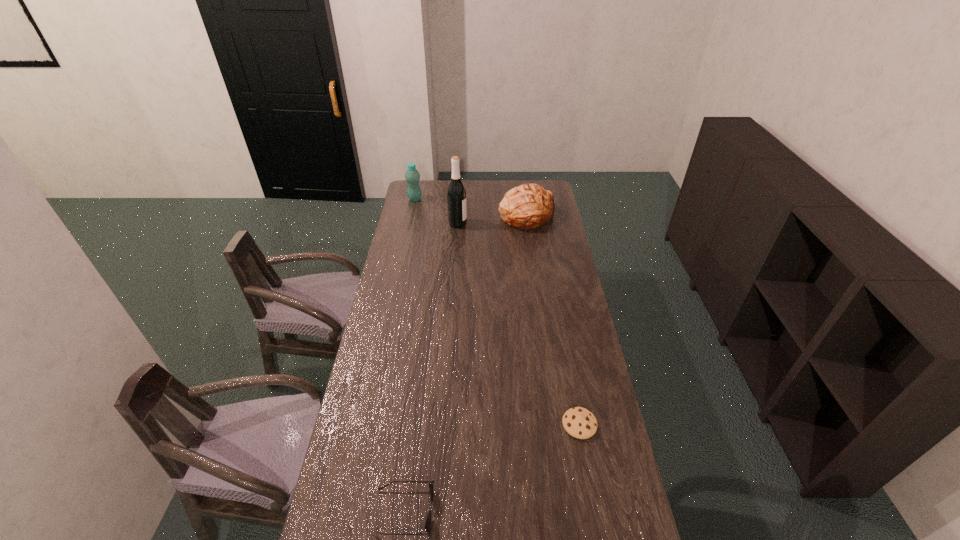
The image size is (960, 540). I want to click on the tallest object, so click(456, 194).

Locate an element on the screen. The image size is (960, 540). water bottle is located at coordinates (412, 176).

You are a GUI agent. You are given a task and a screenshot of the screen. Output one action in this format:
    pyautogui.click(x=<x>, y=<y>)
    Task: Click on the second tallest object
    
    Given the screenshot: What is the action you would take?
    [412, 176]

You are a GUI agent. You are given a task and a screenshot of the screen. Output one action in this format:
    pyautogui.click(x=<x>, y=<y>)
    Task: Click on the third shortest object
    
    Given the screenshot: What is the action you would take?
    pyautogui.click(x=529, y=206)

Locate an element on the screen. Image resolution: width=960 pixels, height=540 pixels. the nearest object is located at coordinates (428, 521).

The width and height of the screenshot is (960, 540). I want to click on sunglasses, so click(x=428, y=521).

Image resolution: width=960 pixels, height=540 pixels. Find the location of `cookie`. cookie is located at coordinates (580, 423).

You are a GUI agent. You are given a task and a screenshot of the screen. Output one action in this format:
    pyautogui.click(x=<x>, y=<y>)
    Task: Click on the second nearest object
    The height and width of the screenshot is (540, 960).
    Given the screenshot: What is the action you would take?
    pyautogui.click(x=580, y=423)

Locate an element on the screen. Image resolution: width=960 pixels, height=540 pixels. vacant space located on the label of the wine bottle is located at coordinates (535, 224).

The height and width of the screenshot is (540, 960). I want to click on vacant area located at the front cap of the water bottle, so click(x=412, y=214).